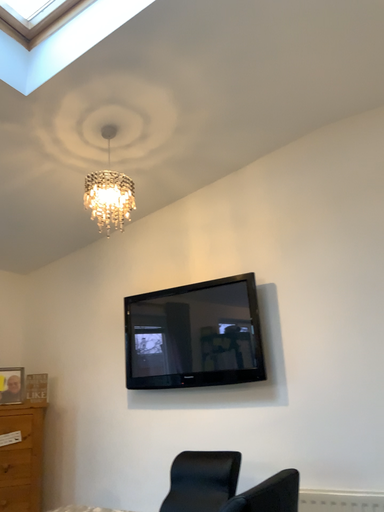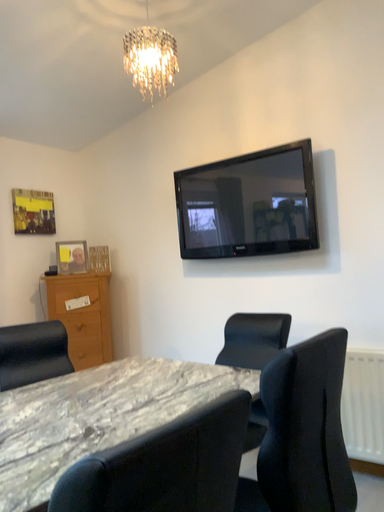
Question: Which way did the camera rotate in the video?

Choices:
 (A) rotated downward
 (B) rotated upward

Answer: (A)